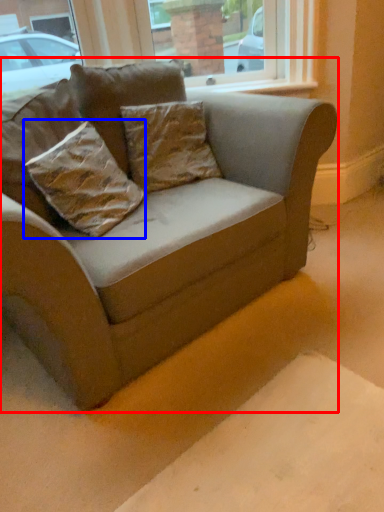
Question: Which of the following is the farthest to the observer, studio couch (highlighted by a red box) or pillow (highlighted by a blue box)?

Choices:
 (A) studio couch
 (B) pillow

Answer: (B)